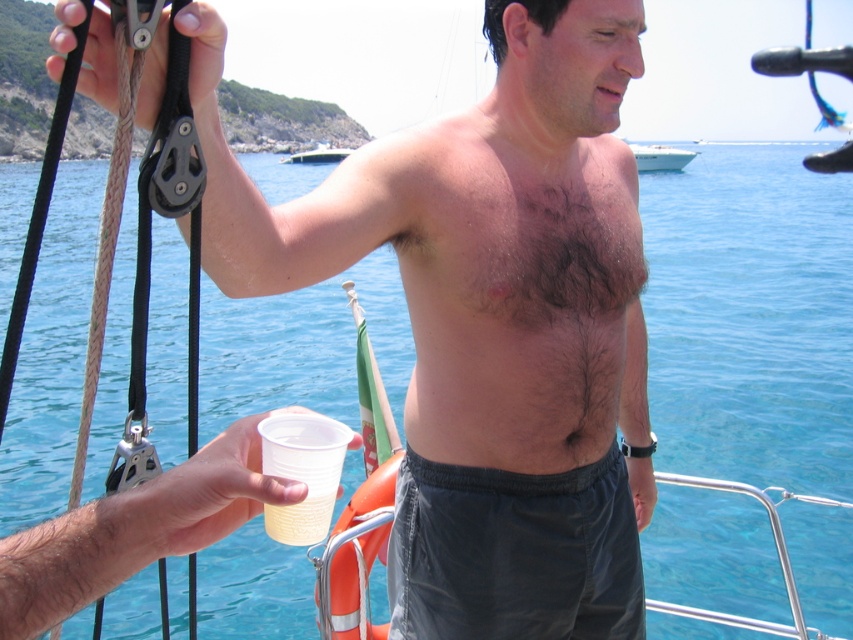
Question: Is smooth plastic cup at center smaller than dark gray fabric shorts at lower center?

Choices:
 (A) no
 (B) yes

Answer: (A)

Question: Is smooth plastic cup at center to the left of dark gray fabric shorts at lower center from the viewer's perspective?

Choices:
 (A) no
 (B) yes

Answer: (B)

Question: Can you confirm if brown hairy chest at center is smaller than translucent plastic cup at lower center?

Choices:
 (A) no
 (B) yes

Answer: (A)

Question: Among these objects, which one is farthest from the camera?

Choices:
 (A) white glossy boat at upper center
 (B) white plastic cup at upper center

Answer: (B)

Question: Which point is closer to the camera taking this photo?

Choices:
 (A) (285, 161)
 (B) (364, 220)

Answer: (B)

Question: Which object is positioned farthest from the translucent plastic cup at lower center?

Choices:
 (A) white glossy boat at upper center
 (B) white plastic cup at upper center

Answer: (B)